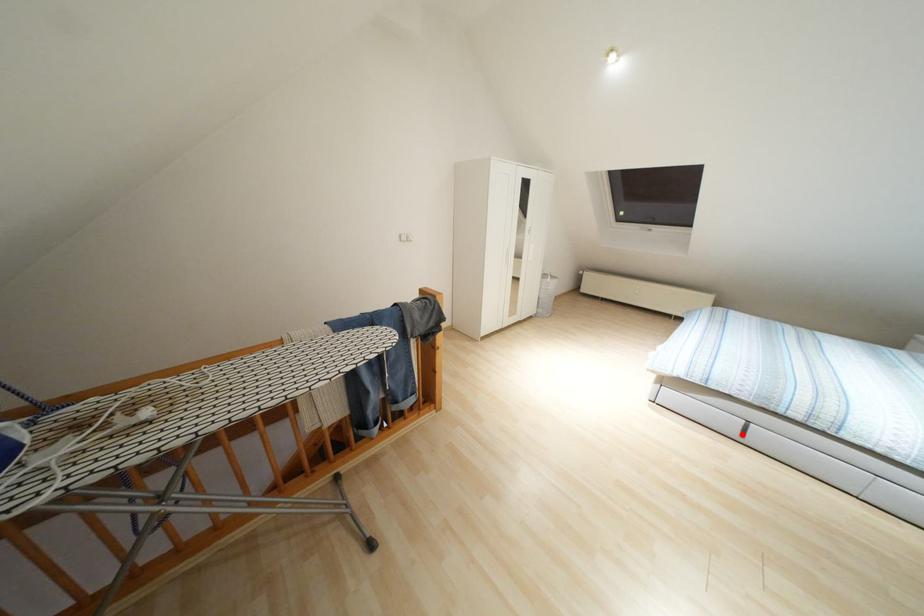
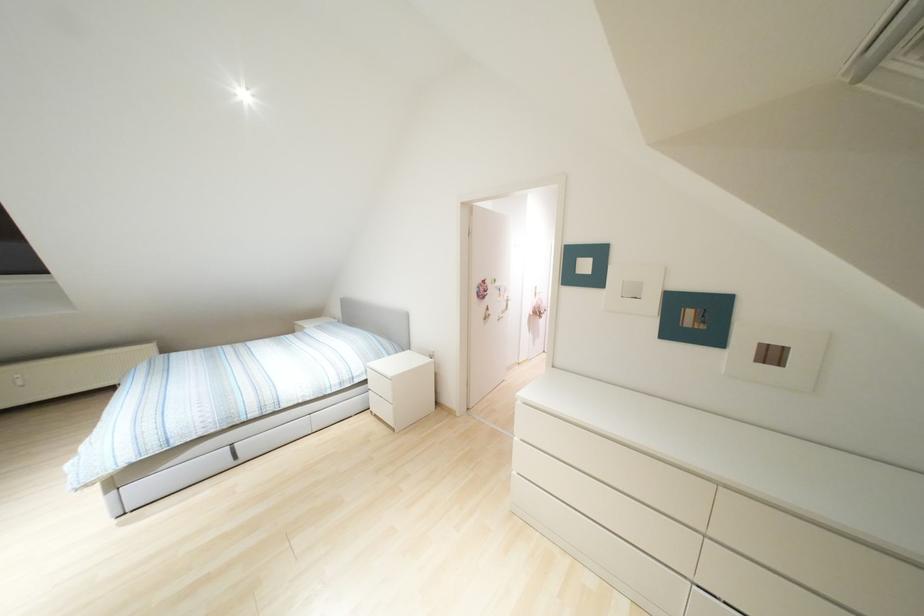
In the second image, find the point that corresponds to the highlighted location in the first image.

(235, 456)